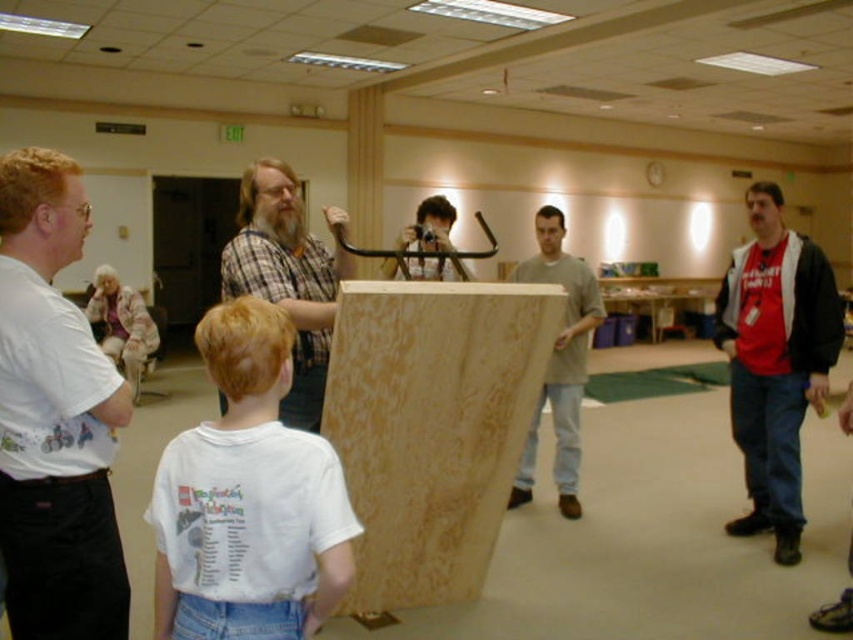
You are standing at the entrance of the room and want to reach the point marked as point (90,420). Which direction should you move relative to the point (225,608) to get there?

To reach point (90,420), you should move behind point (225,608) because point (90,420) is located behind point (225,608).